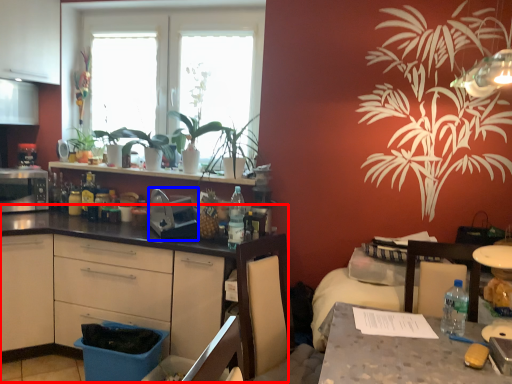
Question: Which of the following is the closest to the observer, countertop (highlighted by a red box) or appliance (highlighted by a blue box)?

Choices:
 (A) countertop
 (B) appliance

Answer: (A)